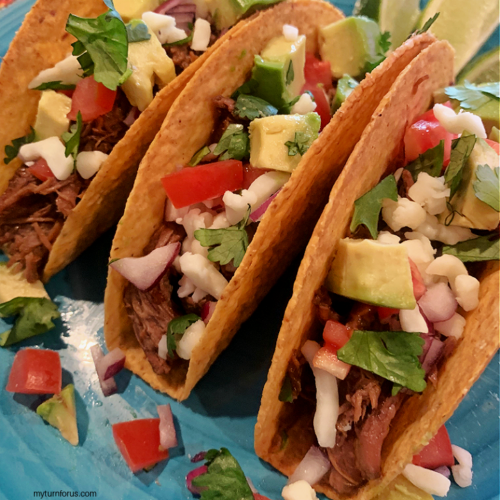
Find the location of a particular element. The width and height of the screenshot is (500, 500). blue plate is located at coordinates (211, 424).